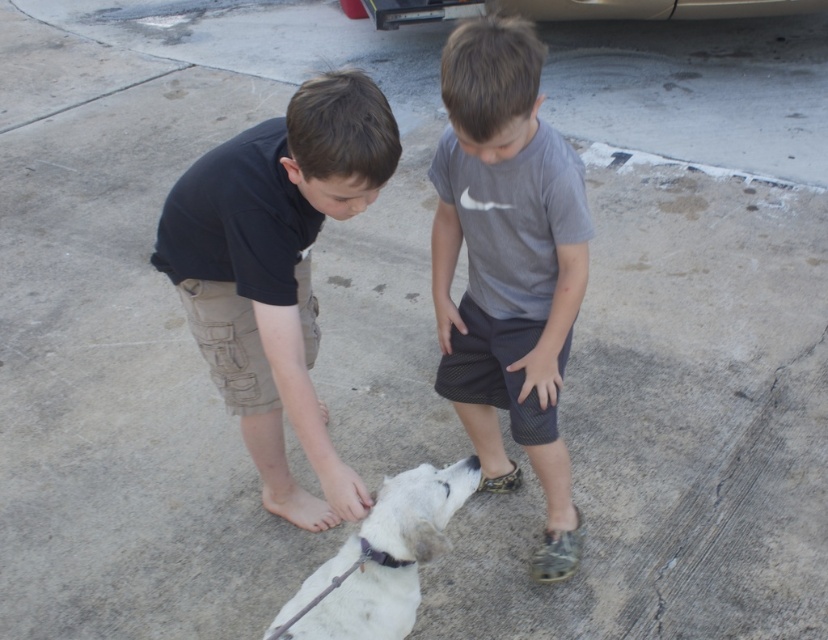
Looking at this image, you are standing at the point labeled point (451, 179) and want to walk to the point labeled point (268, 474). Which direction should you face to walk straight towards your destination?

You should face southwest to walk straight towards point (268, 474) from point (451, 179) because point (451, 179) is in front of point (268, 474).

You are a photographer trying to capture a closeup of the white fur paw at lower center while ensuring the bare skin at lower left is also visible in the frame. Which direction should you move your camera to include both elements without changing the zoom?

The bare skin at lower left is positioned on the left side of white fur paw at lower center. To include both in the frame without changing the zoom, move the camera slightly to the left so that the bare skin at lower left remains visible while keeping the white fur paw at lower center centered.

You are a photographer trying to capture the scene where the two boys are interacting with the dog. You want to place your camera so that the gray cotton shirt at center is exactly in the center of the frame. Where should you position the camera relative to the boys?

The gray cotton shirt at center is located at point (508, 266) in the 2D space, so you should position the camera so that this point is centered in the frame.